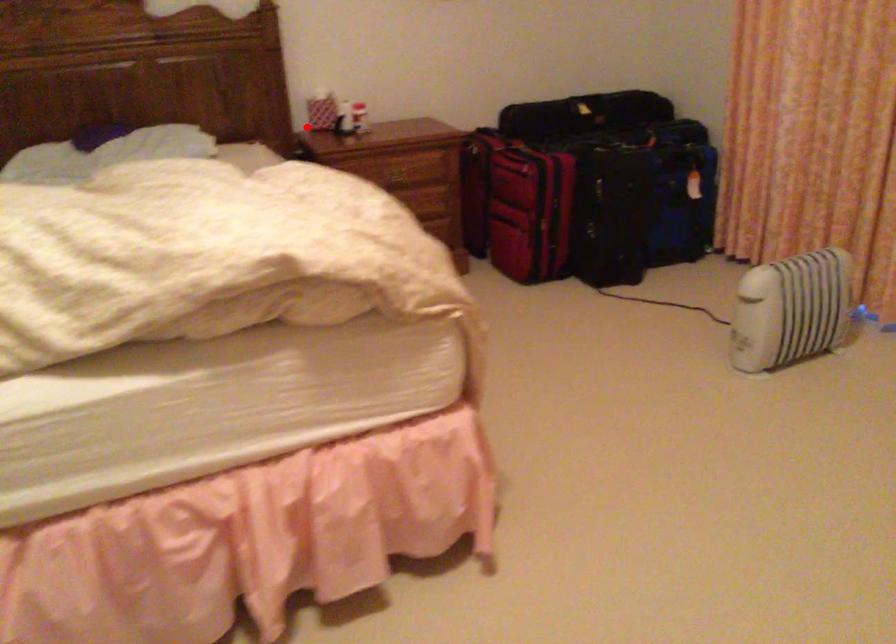
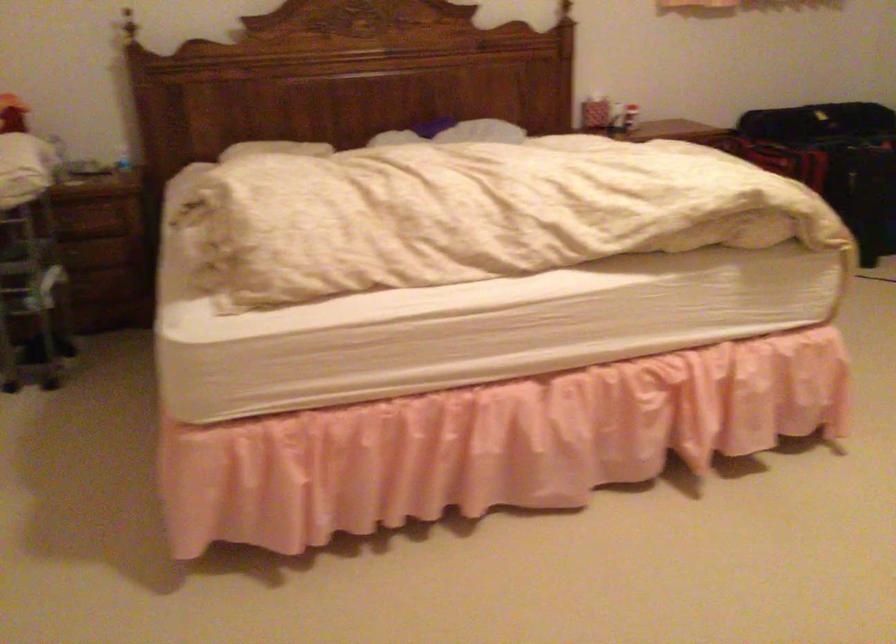
In the second image, find the point that corresponds to the highlighted location in the first image.

(590, 109)